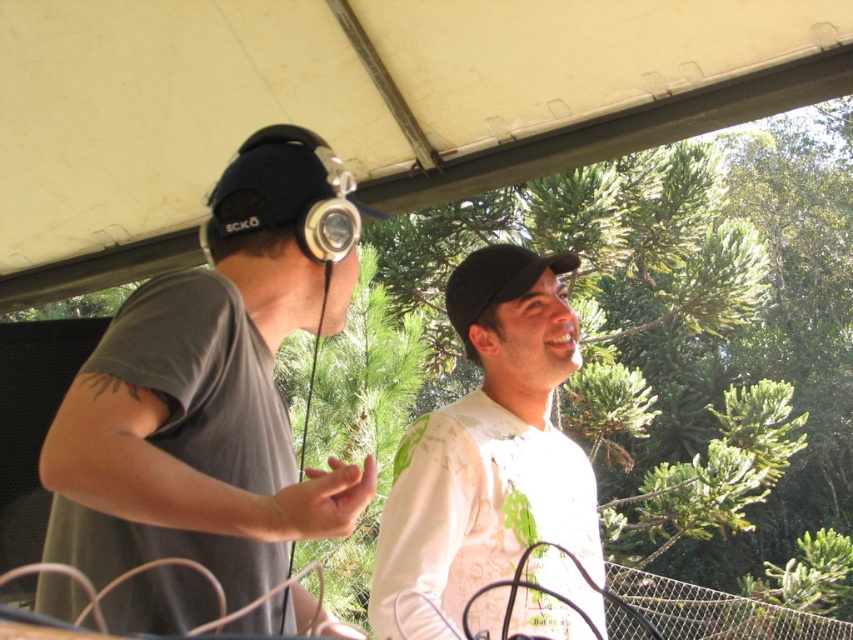
Question: Is gray matte t-shirt at left wider than black matte baseball hat at center?

Choices:
 (A) no
 (B) yes

Answer: (B)

Question: Which object is the farthest from the white matte shirt at center?

Choices:
 (A) gray matte t-shirt at left
 (B) black matte baseball hat at center

Answer: (A)

Question: From the image, what is the correct spatial relationship of gray matte t-shirt at left in relation to black matte baseball hat at center?

Choices:
 (A) above
 (B) below

Answer: (B)

Question: Which point is farther from the camera taking this photo?

Choices:
 (A) (473, 252)
 (B) (163, 506)
 (C) (531, 269)

Answer: (A)

Question: From the image, what is the correct spatial relationship of gray matte t-shirt at left in relation to white matte shirt at center?

Choices:
 (A) left
 (B) right

Answer: (A)

Question: Which point is closer to the camera?

Choices:
 (A) gray matte t-shirt at left
 (B) black matte baseball hat at center
 (C) white matte shirt at center

Answer: (A)